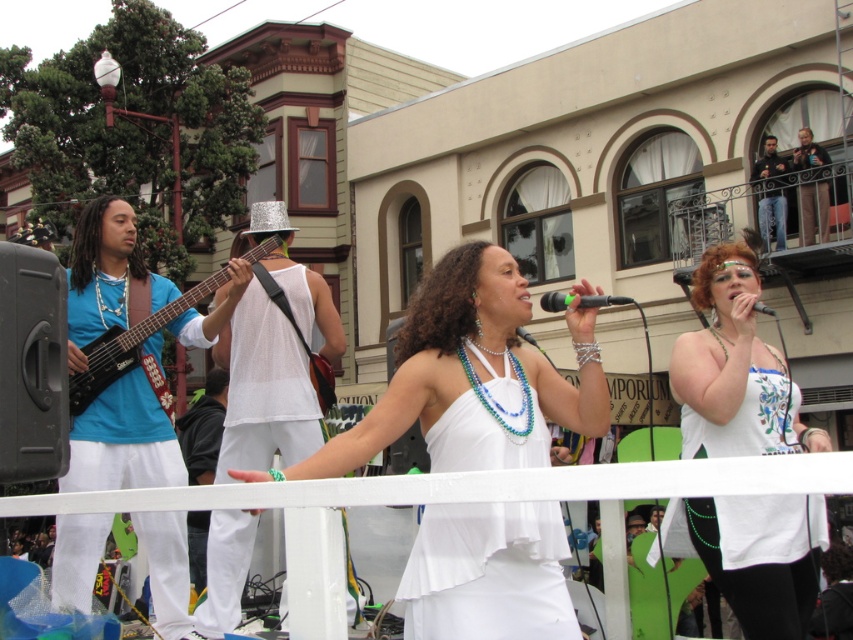
You are a photographer at the event and want to capture a closeup of the performer. The white fabric dress at center is wider than the white matte microphone at center. Which object should you focus on to ensure the entire dress fits in the frame?

The white fabric dress at center is wider than the white matte microphone at center, so focusing on the dress ensures the entire dress fits in the frame.

You are standing at the point marked by the viewer. You want to walk straight towards the point at location point (556, 596). How far will you have to walk to reach that point?

The distance between you and the point (556, 596) is 36.89 feet, so you will have to walk 36.89 feet to reach that point.

You are a photographer at the event and want to capture both the white satin dress at center and the white matte microphone at center in a single frame. Since the camera has limited focus range, which object should you prioritize to ensure it is in focus, considering their sizes?

The white satin dress at center has a larger size compared to the white matte microphone at center, so you should prioritize focusing on the white satin dress at center to ensure it is in focus.